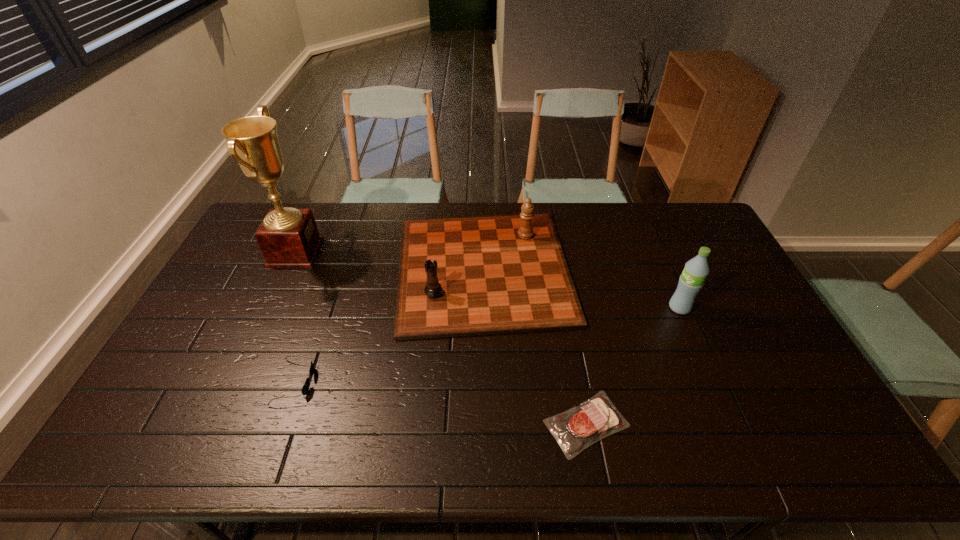
This screenshot has height=540, width=960. I want to click on free location located on the front of the gameboard, so click(484, 389).

The width and height of the screenshot is (960, 540). I want to click on free space located 0.050m on the lenses of the second shortest object, so click(x=331, y=382).

Where is `free space located on the right of the shortest object`? The image size is (960, 540). free space located on the right of the shortest object is located at coordinates (752, 424).

Image resolution: width=960 pixels, height=540 pixels. Identify the location of trophy cup present at the far edge. (288, 237).

Find the location of a particular element. gameboard present at the far edge is located at coordinates (494, 274).

You are a GUI agent. You are given a task and a screenshot of the screen. Output one action in this format:
    pyautogui.click(x=<x>, y=<y>)
    Task: Click on the object that is at the near edge
    
    Given the screenshot: What is the action you would take?
    pyautogui.click(x=576, y=429)

Image resolution: width=960 pixels, height=540 pixels. I want to click on object that is at the left edge, so click(x=288, y=237).

Where is `object located in the far left corner section of the desktop`? object located in the far left corner section of the desktop is located at coordinates (288, 237).

I want to click on free region at the far edge, so click(x=617, y=232).

Find the location of a particular element. The width and height of the screenshot is (960, 540). vacant space at the near edge of the desktop is located at coordinates click(x=351, y=428).